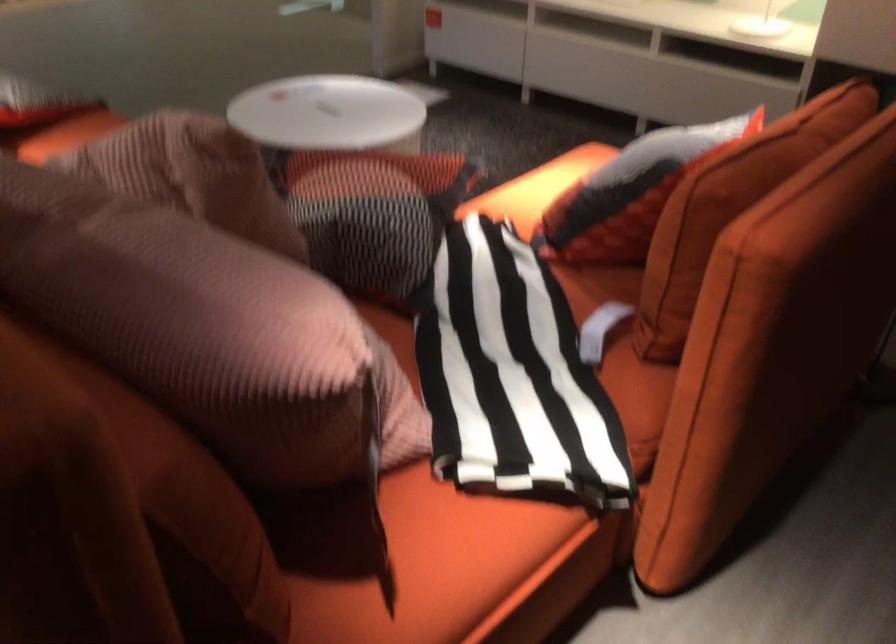
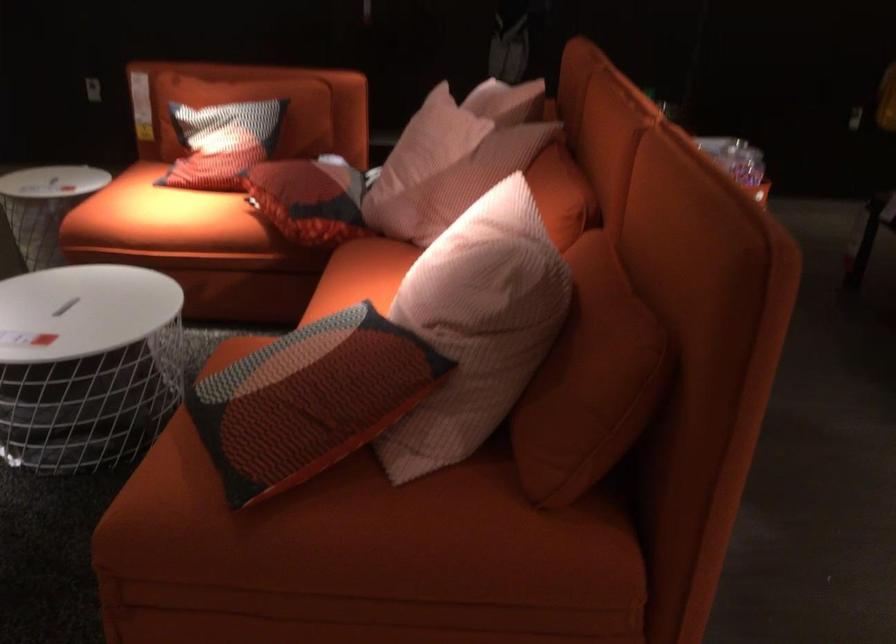
Question: I am providing you with two images of the same scene from different viewpoints. Which of the following objects are not visible in image2?

Choices:
 (A) pink ribbed pillow
 (B) blue cleaning cloth
 (C) patterned pillow
 (D) red patterned pillow

Answer: (A)